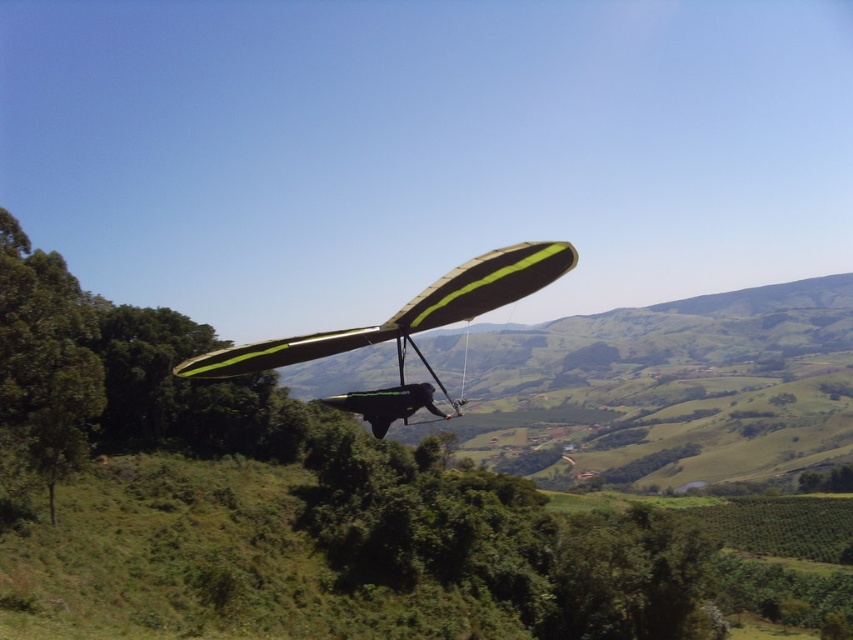
From the picture: You are a drone operator trying to capture aerial footage. You notice a green leafy tree at left and a green matte parachute at center in your camera view. Which object is closer to your drone?

The green leafy tree at left is closer to the drone because it is further to the viewer than the green matte parachute at center, indicating it is nearer in the visual perspective.

You are a drone operator trying to capture the hang glider in the image. You need to adjust your camera to focus on both the point at coordinates point (22, 250) and point (213, 360). Which point is closer to the camera?

Point (213, 360) is closer to the camera than point (22, 250).